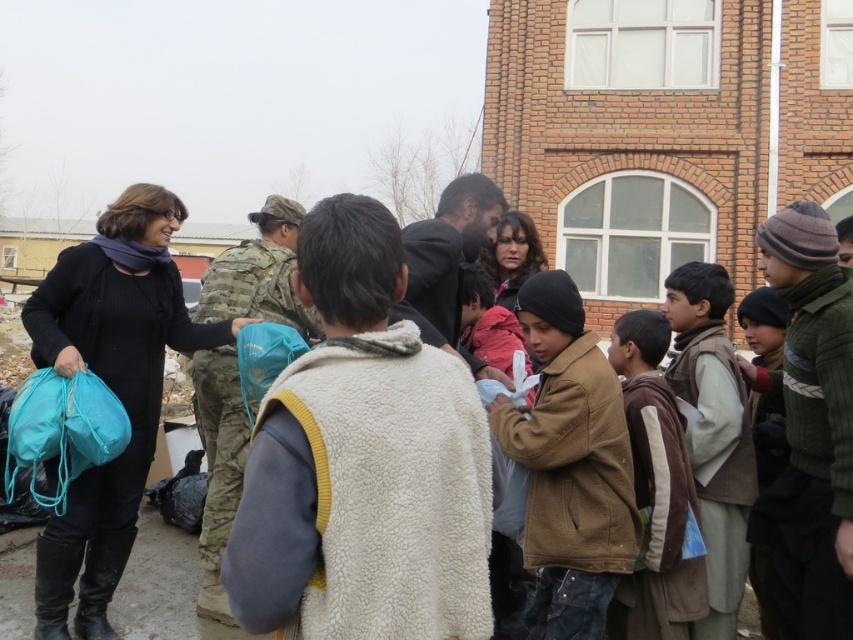
You are standing in front of the brick building and want to greet both the person wearing the brown suede jacket at center and the person in the brown woolen vest at right. Which individual should you approach first based on their proximity to you?

You should approach the brown suede jacket at center first because it is closer to you than the brown woolen vest at right.

What is located at the coordinates point (363, 461)?

The white fuzzy vest at center is located at point (363, 461).